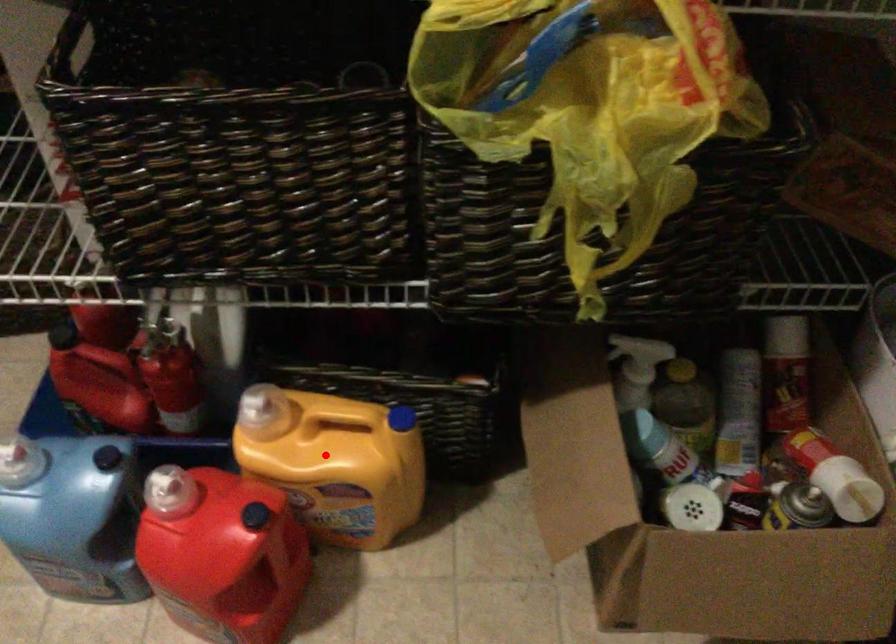
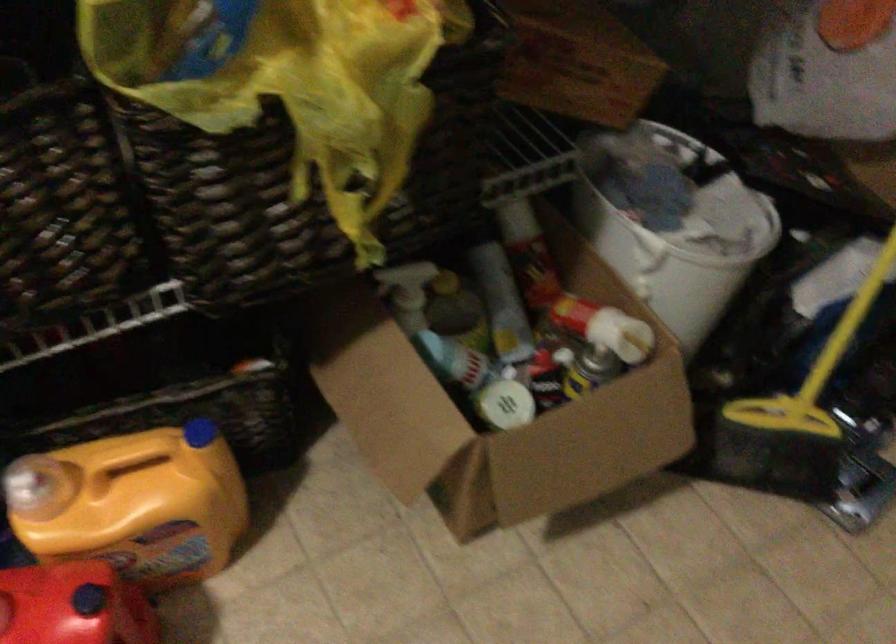
Find the pixel in the second image that matches the highlighted location in the first image.

(133, 504)